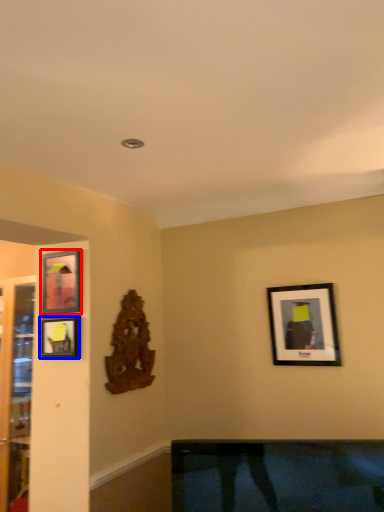
Question: Which object is closer to the camera taking this photo, picture frame (highlighted by a red box) or picture frame (highlighted by a blue box)?

Choices:
 (A) picture frame
 (B) picture frame

Answer: (B)